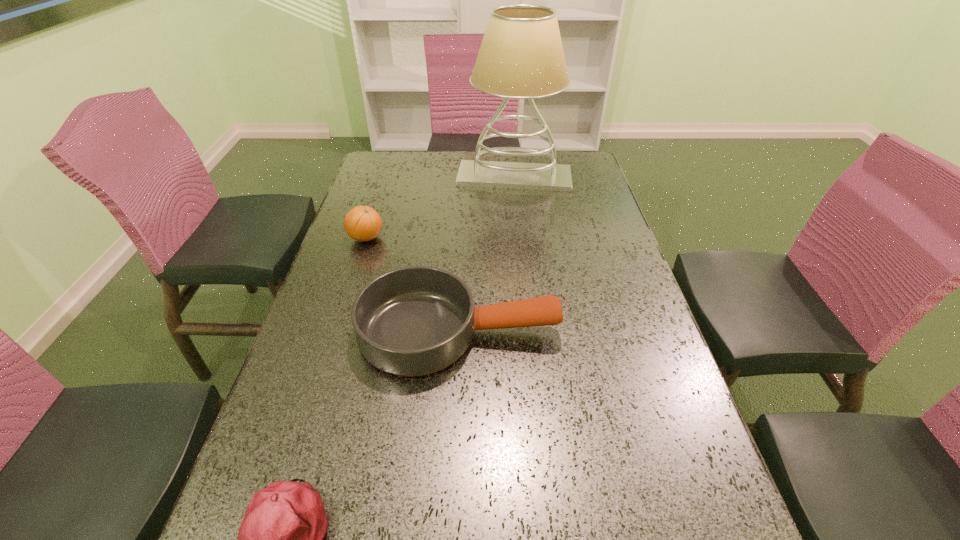
Identify the location of table lamp. (521, 56).

Find the location of a particular element. Image resolution: width=960 pixels, height=540 pixels. the tallest object is located at coordinates (521, 56).

At what (x,y) coordinates should I click in order to perform the action: click on the taller orange fruit. Please return your answer as a coordinate pair (x, y). This screenshot has width=960, height=540. Looking at the image, I should click on (362, 223).

The width and height of the screenshot is (960, 540). In order to click on the left orange fruit in this screenshot , I will do `click(362, 223)`.

Identify the location of pan. (412, 321).

You are a GUI agent. You are given a task and a screenshot of the screen. Output one action in this format:
    pyautogui.click(x=<x>, y=<y>)
    Task: Click on the blank space located on the front of the tallest object
    This screenshot has width=960, height=540.
    Given the screenshot: What is the action you would take?
    pyautogui.click(x=517, y=210)

The height and width of the screenshot is (540, 960). I want to click on blank space located on the back of the taller orange fruit, so point(386,174).

Find the location of `free spot located 0.170m on the handle side of the third farthest object`. free spot located 0.170m on the handle side of the third farthest object is located at coordinates (634, 332).

You are a GUI agent. You are given a task and a screenshot of the screen. Output one action in this format:
    pyautogui.click(x=<x>, y=<y>)
    Task: Click on the object that is at the far edge
    This screenshot has height=540, width=960.
    Given the screenshot: What is the action you would take?
    pyautogui.click(x=521, y=56)

You are a GUI agent. You are given a task and a screenshot of the screen. Output one action in this format:
    pyautogui.click(x=<x>, y=<y>)
    Task: Click on the orange present at the left edge
    The height and width of the screenshot is (540, 960).
    Given the screenshot: What is the action you would take?
    pyautogui.click(x=362, y=223)